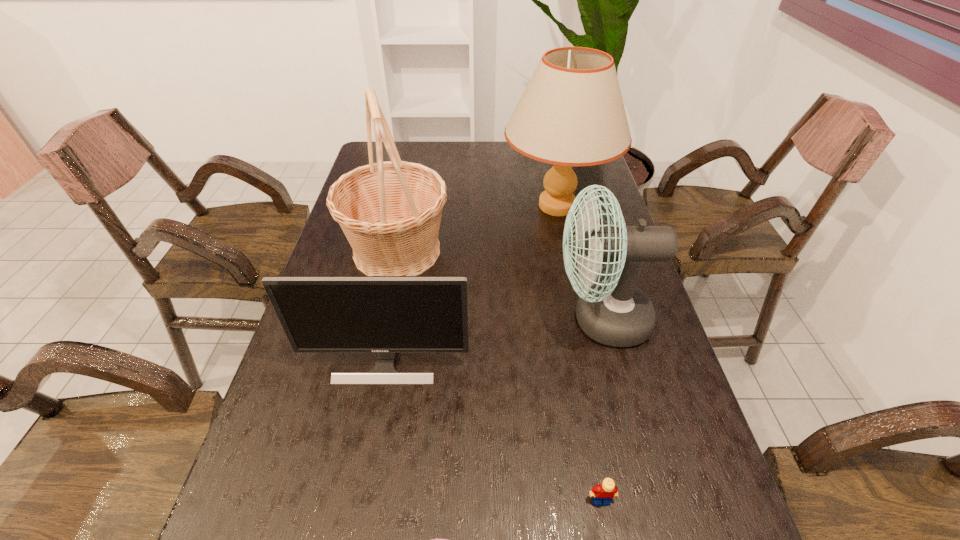
You are a GUI agent. You are given a task and a screenshot of the screen. Output one action in this format:
    pyautogui.click(x=<x>, y=<y>)
    Task: Click on the lampshade
    This screenshot has width=960, height=540.
    Given the screenshot: What is the action you would take?
    pyautogui.click(x=571, y=113)

Image resolution: width=960 pixels, height=540 pixels. What are the coordinates of `basket` in the screenshot? It's located at (390, 212).

This screenshot has height=540, width=960. Find the location of `fan`. fan is located at coordinates (615, 312).

Locate an element on the screen. Image resolution: width=960 pixels, height=540 pixels. monitor is located at coordinates (386, 315).

At what (x,y) coordinates should I click in order to perform the action: click on the second shortest object. Please return your answer as a coordinate pair (x, y). Looking at the image, I should click on (603, 493).

Find the location of a particular element. The image size is (960, 540). the fifth farthest object is located at coordinates (603, 493).

This screenshot has height=540, width=960. Find the location of `blank space located 0.110m on the back of the lampshade`. blank space located 0.110m on the back of the lampshade is located at coordinates (547, 161).

Image resolution: width=960 pixels, height=540 pixels. In order to click on free space located 0.280m on the front of the basket in this screenshot , I will do (371, 378).

Locate an element on the screen. This screenshot has width=960, height=540. free spot located 0.310m in front of the fan where the airflow is directed is located at coordinates pyautogui.click(x=428, y=319).

Locate an element on the screen. The height and width of the screenshot is (540, 960). free space located 0.330m in front of the fan where the airflow is directed is located at coordinates (420, 319).